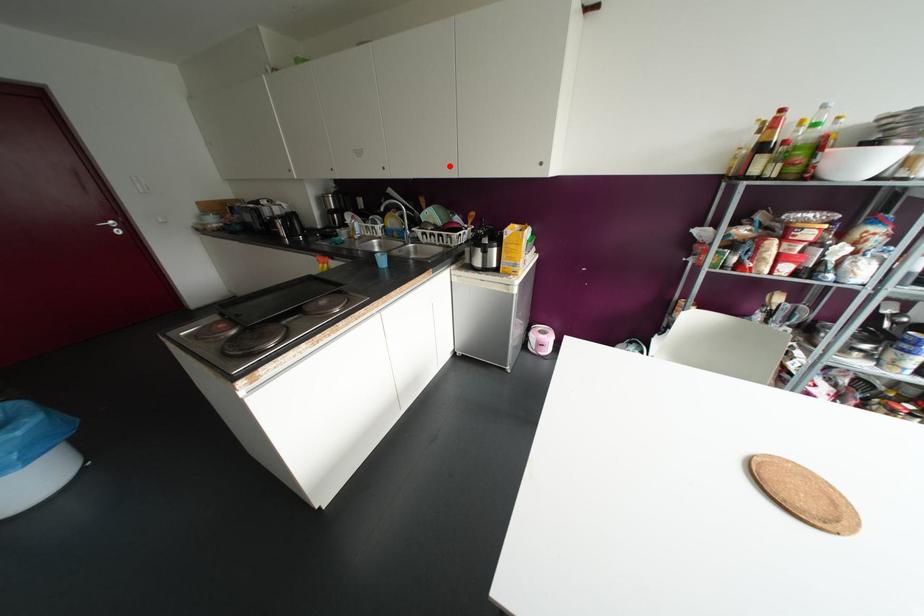
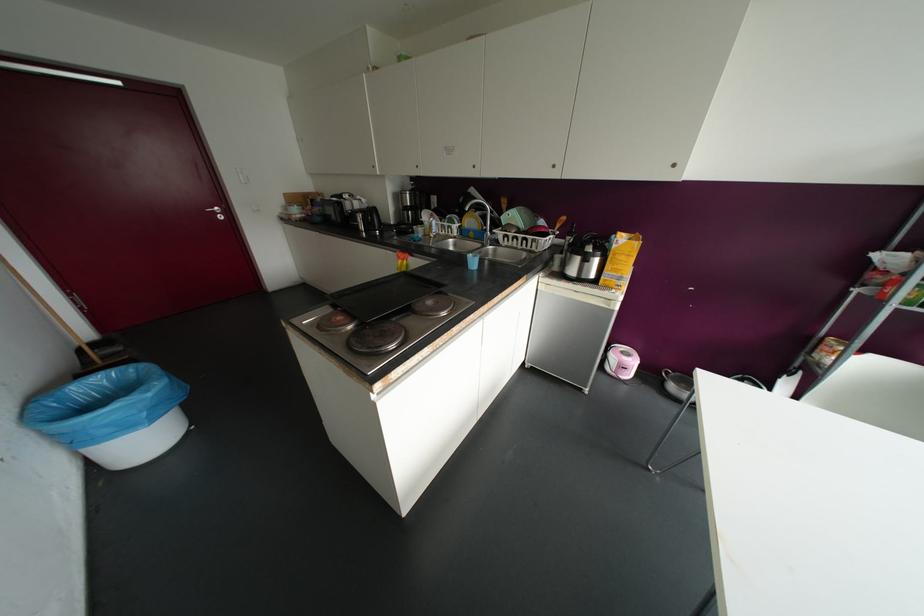
Question: I am providing you with two images of the same scene from different viewpoints. Image1 has a red point marked. In image2, the corresponding 3D location appears at what relative position? Reply with the corresponding letter.

Choices:
 (A) Closer
 (B) Farther

Answer: (B)